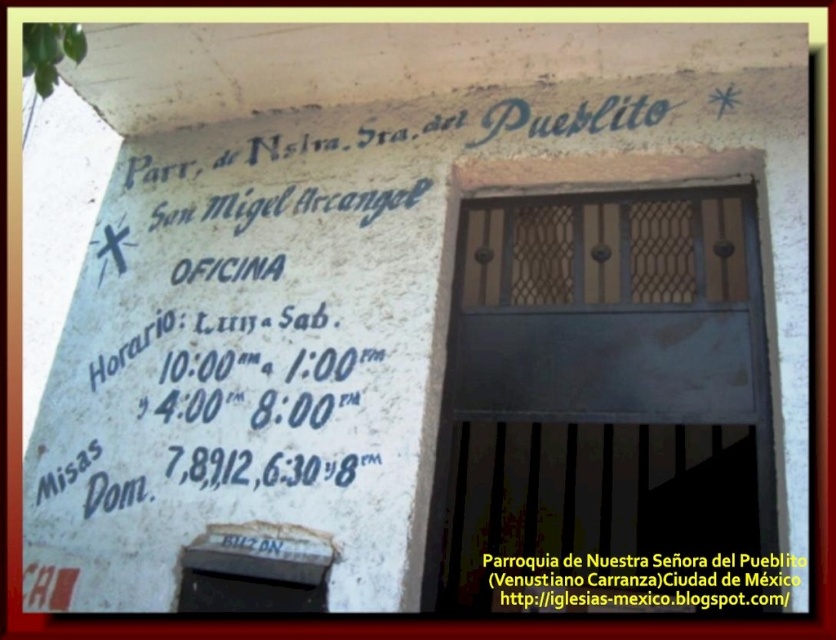
Is point (738, 212) positioned in front of point (760, 561)?

No, (738, 212) is behind (760, 561).

Between point (732, 403) and point (663, 576), which one is positioned behind?

Point (663, 576)

Locate an element on the screen. dark gray metal door at center is located at coordinates (600, 401).